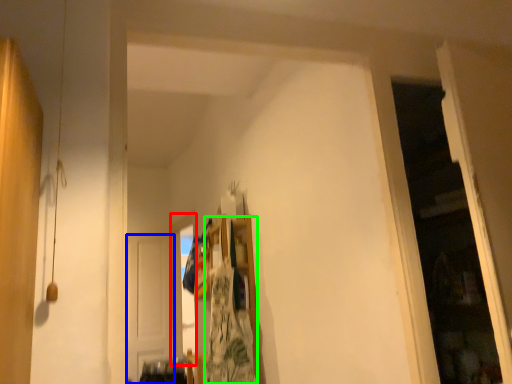
Question: Considering the real-world distances, which object is closest to window (highlighted by a red box)? door (highlighted by a blue box) or laundry (highlighted by a green box).

Choices:
 (A) door
 (B) laundry

Answer: (A)